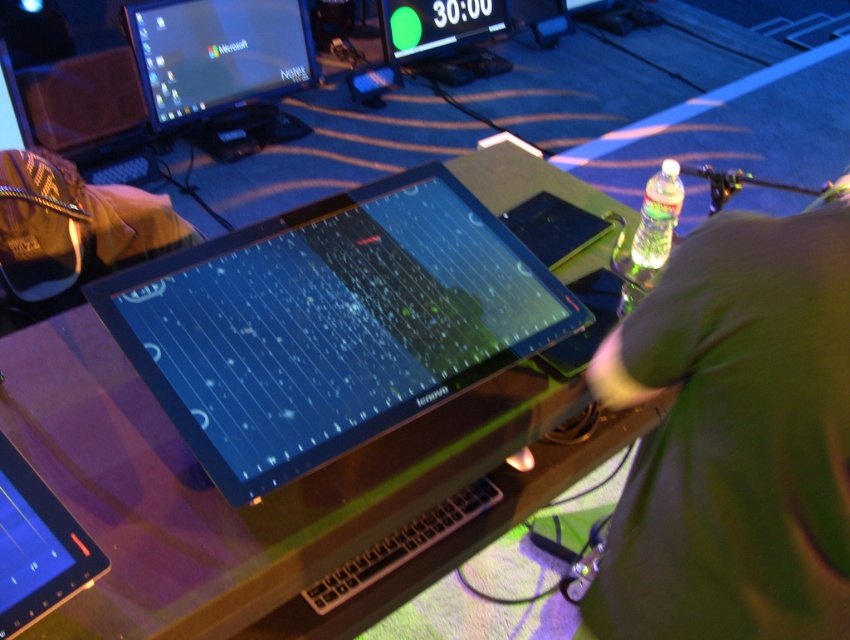
You are organizing your desk and need to know which object is smaller between the black glossy tablet at lower left and the matte black monitor at upper center. Can you tell me?

The black glossy tablet at lower left is smaller than the matte black monitor at upper center according to the description.

You are designing a layout for a tech workspace and need to place a new monitor. The existing setup has a matte black monitor at upper left. Where should you place the new monitor to avoid overlapping with the existing one?

The matte black monitor at upper left is located at point (218, 54), so place the new monitor in an area that does not overlap this coordinate.